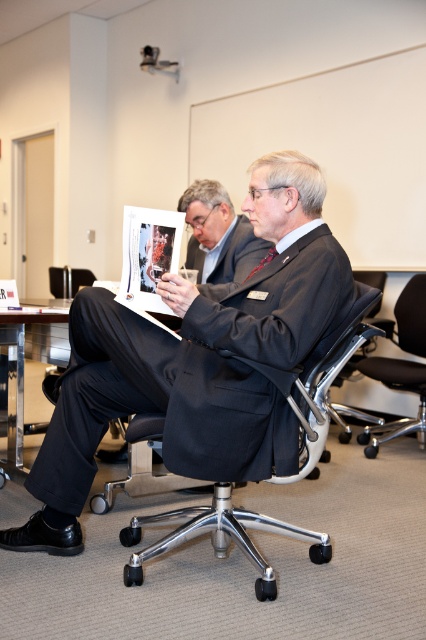
Is point (403, 308) positioned before point (218, 276)?

No, (403, 308) is behind (218, 276).

Who is more distant from viewer, (412, 376) or (201, 264)?

Point (412, 376)

At what (x,y) coordinates should I click in order to perform the action: click on black mesh swivel chair at center. Please return your answer as a coordinate pair (x, y). The image size is (426, 640). Looking at the image, I should click on (397, 388).

Is matte black suit at center to the right of black mesh swivel chair at center from the viewer's perspective?

Incorrect, matte black suit at center is not on the right side of black mesh swivel chair at center.

Between point (330, 310) and point (417, 294), which one is positioned behind?

Point (417, 294)

I want to click on matte black suit at center, so click(196, 362).

Looking at this image, does metallic silver swivel chair at center appear under metallic polished table at lower left?

Correct, metallic silver swivel chair at center is located below metallic polished table at lower left.

Who is more forward, (313, 433) or (17, 353)?

Point (313, 433)

Is point (299, 404) farther from camera compared to point (9, 408)?

No, (299, 404) is in front of (9, 408).

Locate an element on the screen. The width and height of the screenshot is (426, 640). metallic silver swivel chair at center is located at coordinates (218, 536).